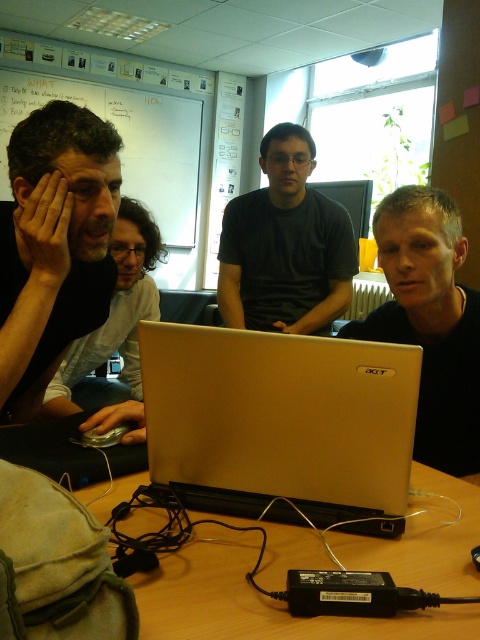
You are sitting at the wooden table at lower center and want to hand a document to the person wearing the dark gray shirt at center. In which direction should you pass the document?

Since the wooden table at lower center is to the left of the dark gray shirt at center, you should pass the document to your right to reach the person wearing the dark gray shirt at center.

You are sitting at the table and want to grab the matte black shirt at left. Can you reach it without moving the satin gold laptop at center?

The satin gold laptop at center is closer to the viewer than the matte black shirt at left, so you would need to move the laptop to reach the shirt.

You are a photographer taking a picture of the scene. You notice the satin gold laptop at center and the dark gray shirt at center. Which object is positioned lower in the image?

The satin gold laptop at center is positioned lower than the dark gray shirt at center in the image.